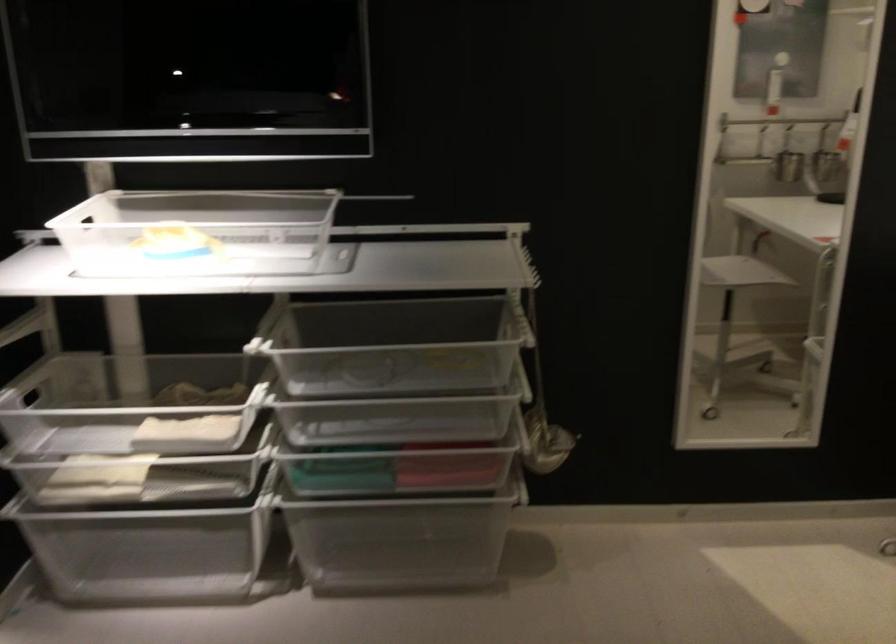
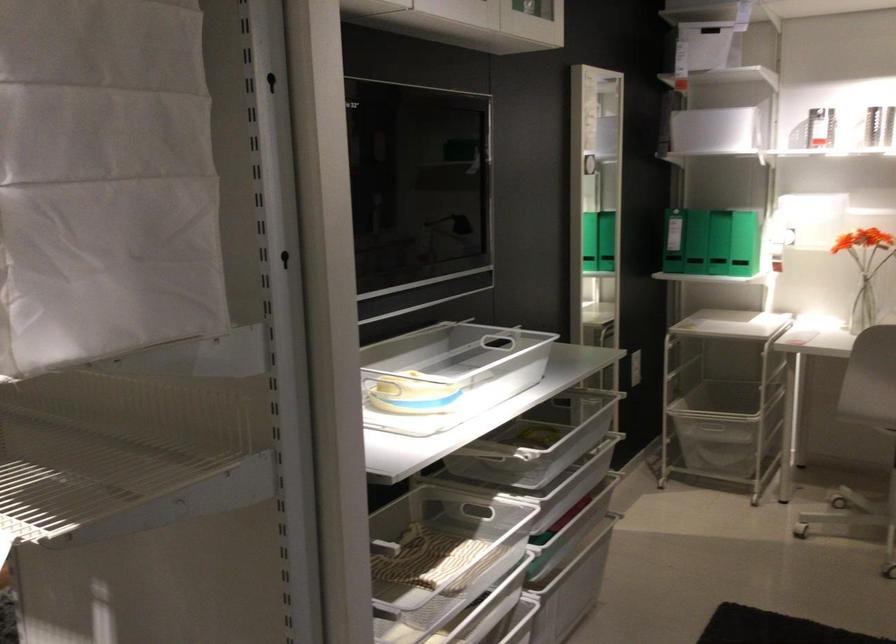
The point at (218,455) is marked in the first image. Where is the corresponding point in the second image?

(441, 544)